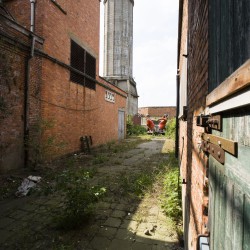
At what (x,y) coordinates should I click in order to perform the action: click on ventilation grate. Please return your answer as a coordinate pair (x, y). This screenshot has height=250, width=250. Looking at the image, I should click on (80, 66).